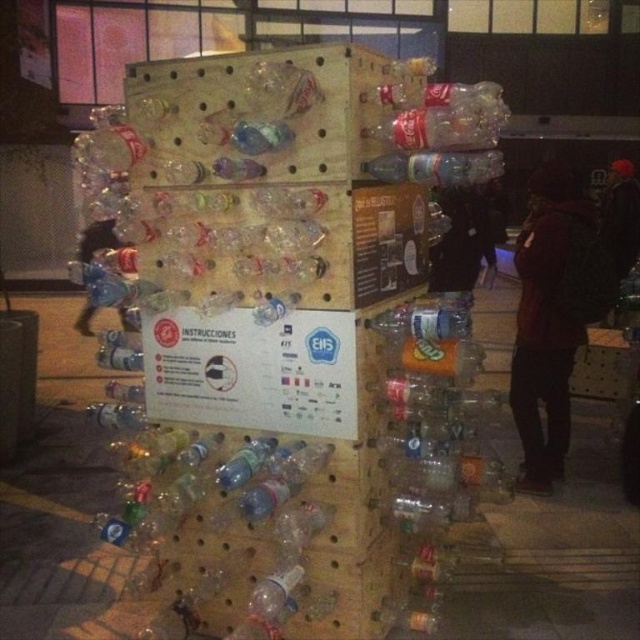
Does point (435, 256) come in front of point (307, 193)?

That is False.

Can you confirm if dark red hoodie at right is taller than translucent plastic bottle at center?

Indeed, dark red hoodie at right has a greater height compared to translucent plastic bottle at center.

Is point (448, 236) farther from viewer compared to point (260, 205)?

Yes, point (448, 236) is behind point (260, 205).

Locate an element on the screen. dark red hoodie at right is located at coordinates (461, 237).

Is dark red hoodie at center wider than translucent plastic bottle at center?

Indeed, dark red hoodie at center has a greater width compared to translucent plastic bottle at center.

Looking at this image, is dark red hoodie at center closer to camera compared to translucent plastic bottle at center?

That is False.

Is point (573, 184) closer to camera compared to point (280, 189)?

No, it is not.

Locate an element on the screen. This screenshot has height=640, width=640. dark red hoodie at center is located at coordinates (550, 317).

Is point (550, 376) more distant than point (284, 301)?

Yes.

Is dark red hoodie at center smaller than clear plastic bottle at center?

Incorrect, dark red hoodie at center is not smaller in size than clear plastic bottle at center.

Is point (588, 323) closer to viewer compared to point (264, 301)?

No, it is behind (264, 301).

Locate an element on the screen. The height and width of the screenshot is (640, 640). dark red hoodie at center is located at coordinates (550, 317).